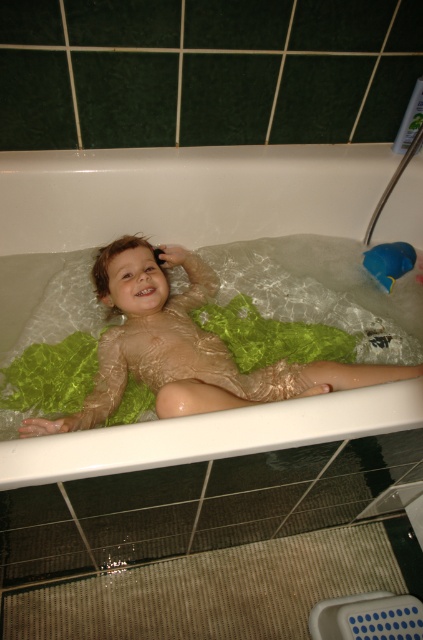
Question: Which of the following is the closest to the observer?

Choices:
 (A) (371, 259)
 (B) (90, 445)

Answer: (B)

Question: Can you confirm if translucent plastic bag at center is positioned above blue rubber duck at upper right?

Choices:
 (A) yes
 (B) no

Answer: (A)

Question: Is translucent plastic bag at center positioned at the back of blue rubber duck at upper right?

Choices:
 (A) no
 (B) yes

Answer: (A)

Question: Can you confirm if translucent plastic bag at center is positioned to the right of blue rubber duck at upper right?

Choices:
 (A) yes
 (B) no

Answer: (B)

Question: Among these objects, which one is farthest from the camera?

Choices:
 (A) blue rubber duck at upper right
 (B) translucent plastic bag at center

Answer: (A)